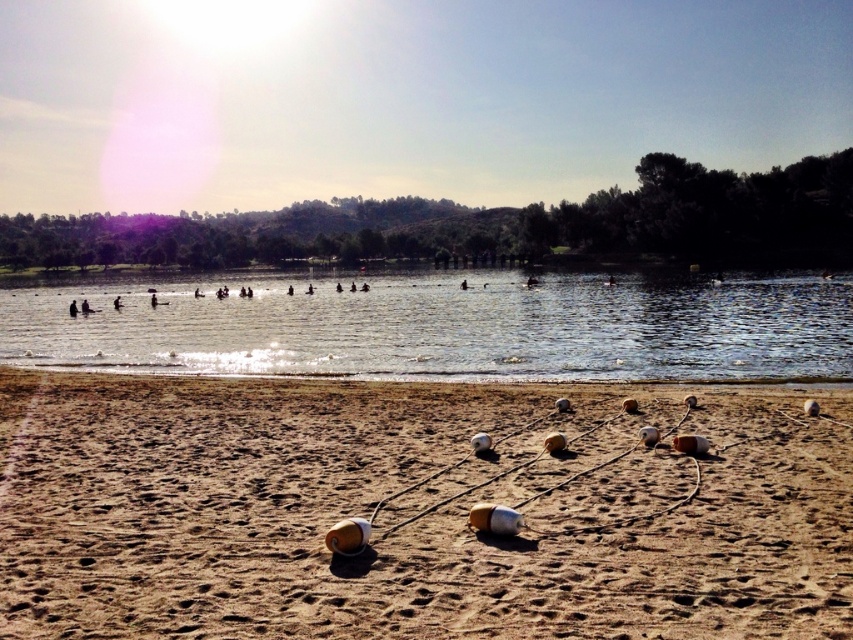
Which is in front, point (345, 451) or point (521, 323)?

Point (345, 451) is in front.

Does brown sandy beach at lower center have a greater width compared to clear water at center?

No.

Does point (769, 621) lie in front of point (529, 321)?

Yes, point (769, 621) is closer to viewer.

Locate an element on the screen. brown sandy beach at lower center is located at coordinates (415, 512).